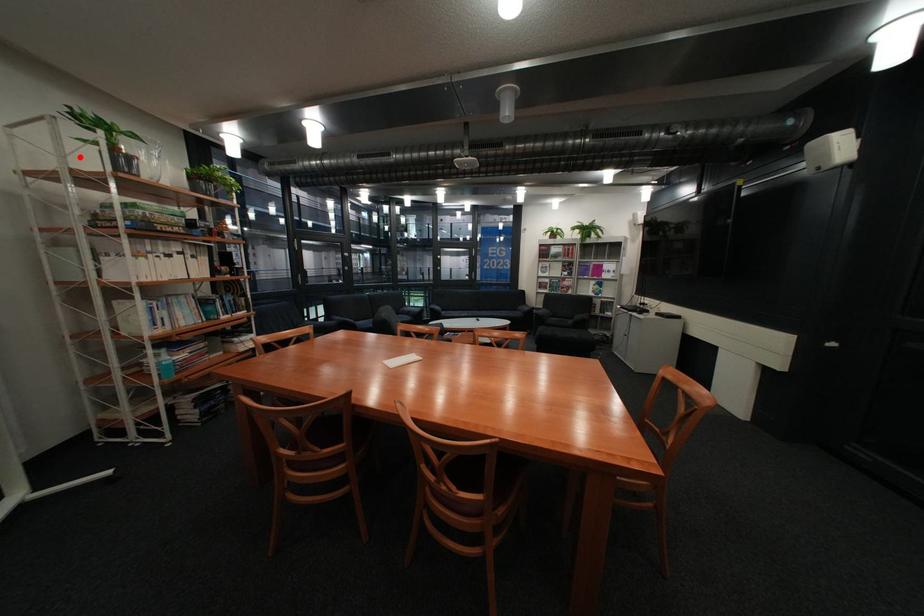
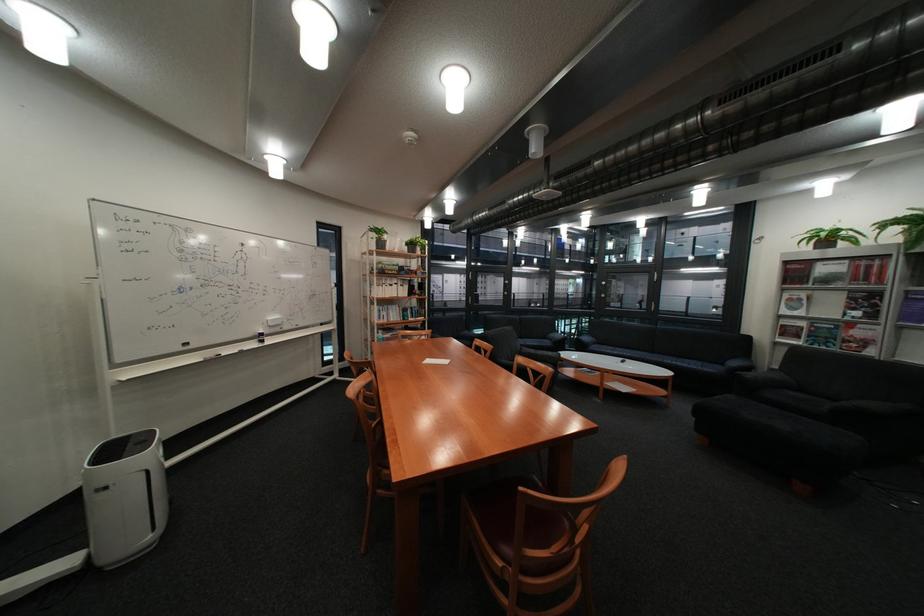
The point at the highlighted location is marked in the first image. Where is the corresponding point in the second image?

(383, 246)